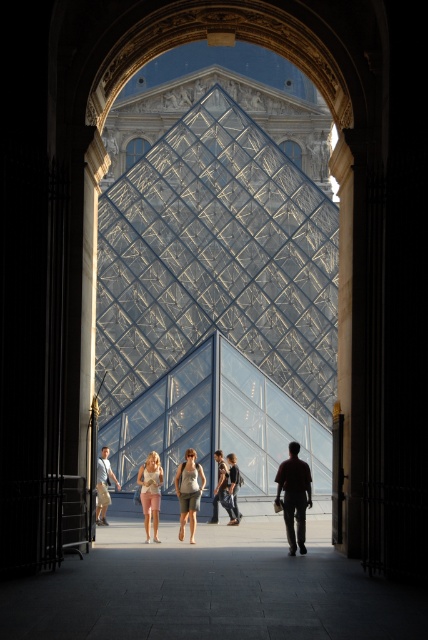
Question: Among these points, which one is nearest to the camera?

Choices:
 (A) (229, 474)
 (B) (216, 493)

Answer: (A)

Question: Can you confirm if white marble pillar at right is positioned to the left of light beige shorts at center?

Choices:
 (A) no
 (B) yes

Answer: (A)

Question: Does silhouette figure at center appear under light brown leather jacket at center?

Choices:
 (A) no
 (B) yes

Answer: (A)

Question: Which of the following is the closest to the observer?

Choices:
 (A) light beige shorts at center
 (B) light pink fabric shorts at center
 (C) silhouette figure at center

Answer: (C)

Question: In this image, where is silhouette figure at center located relative to dark blue jeans at center?

Choices:
 (A) left
 (B) right

Answer: (B)

Question: Which of the following is the farthest from the observer?

Choices:
 (A) (196, 474)
 (B) (238, 486)

Answer: (B)